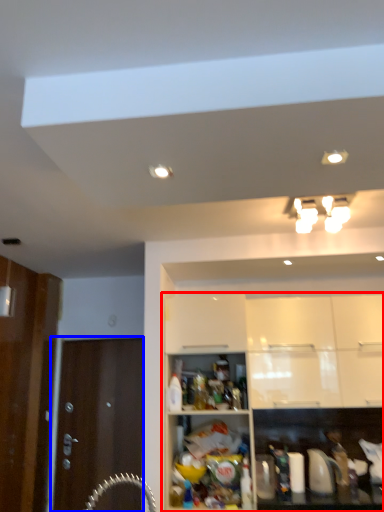
Question: Which object appears closest to the camera in this image, cabinetry (highlighted by a red box) or door (highlighted by a blue box)?

Choices:
 (A) cabinetry
 (B) door

Answer: (A)